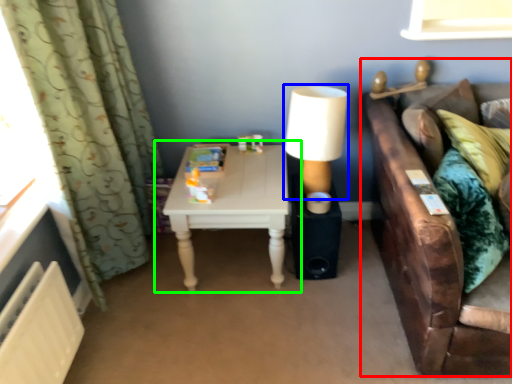
Question: Which object is the farthest from studio couch (highlighted by a red box)? Choose among these: table lamp (highlighted by a blue box) or table (highlighted by a green box).

Choices:
 (A) table lamp
 (B) table

Answer: (B)